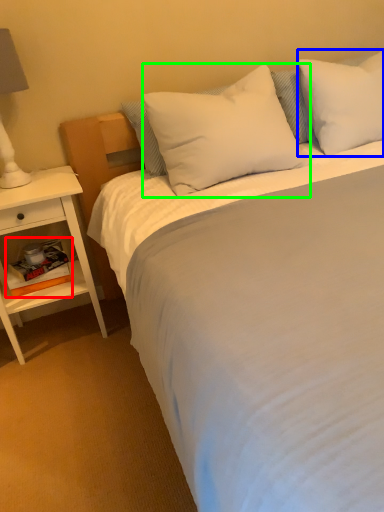
Question: Which is nearer to the book (highlighted by a red box)? pillow (highlighted by a blue box) or pillow (highlighted by a green box).

Choices:
 (A) pillow
 (B) pillow

Answer: (B)